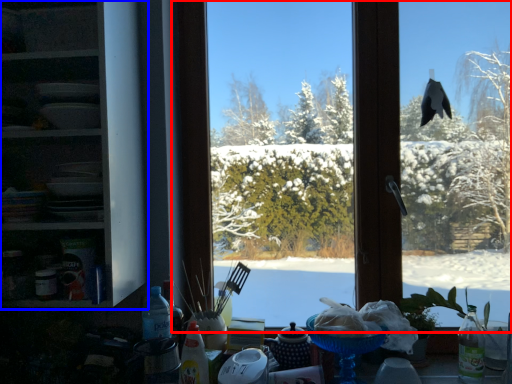
Question: Which point is closer to the camera, window (highlighted by a red box) or shelf (highlighted by a blue box)?

Choices:
 (A) window
 (B) shelf

Answer: (B)